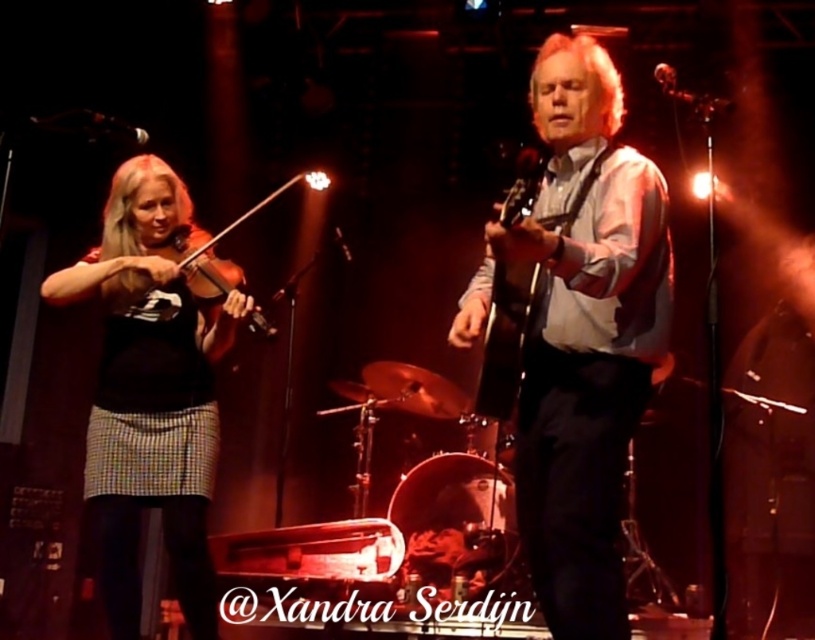
Is matte white shirt at center closer to the viewer compared to wooden violin at left?

Yes, it is.

Which is behind, point (562, 118) or point (311, 179)?

The point (311, 179) is behind.

At what (x,y) coordinates should I click in order to perform the action: click on matte white shirt at center. Please return your answer as a coordinate pair (x, y). The image size is (815, 640). Looking at the image, I should click on (580, 333).

Does glossy wood guitar at center appear on the right side of wooden violin at left?

Correct, you'll find glossy wood guitar at center to the right of wooden violin at left.

Is glossy wood guitar at center thinner than wooden violin at left?

Correct, glossy wood guitar at center's width is less than wooden violin at left's.

What do you see at coordinates (505, 337) in the screenshot?
I see `glossy wood guitar at center` at bounding box center [505, 337].

Find the location of `glossy wood guitar at center`. glossy wood guitar at center is located at coordinates (505, 337).

The width and height of the screenshot is (815, 640). Describe the element at coordinates (580, 333) in the screenshot. I see `matte white shirt at center` at that location.

Looking at this image, does matte white shirt at center have a greater height compared to glossy wood guitar at center?

Yes, matte white shirt at center is taller than glossy wood guitar at center.

Which is behind, point (573, 385) or point (487, 385)?

The point (487, 385) is more distant.

Find the location of a particular element. matte white shirt at center is located at coordinates (580, 333).